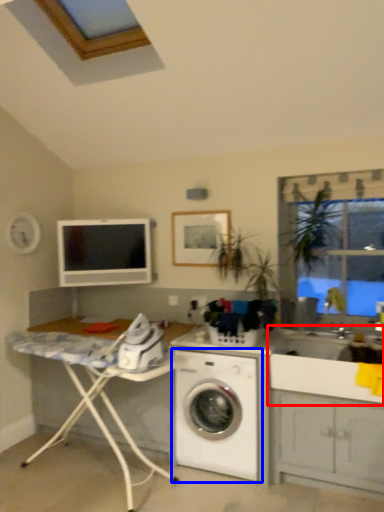
Question: Which point is further to the camera, sink (highlighted by a red box) or washing machine (highlighted by a blue box)?

Choices:
 (A) sink
 (B) washing machine

Answer: (B)